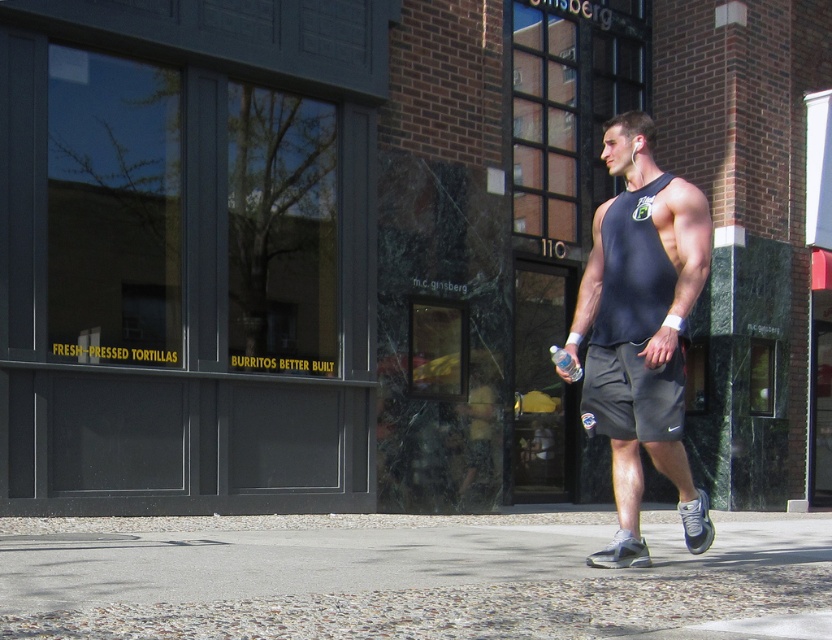
Question: Which of the following is the farthest from the observer?

Choices:
 (A) gray fabric shorts at center
 (B) gray cobblestone pavement at lower center
 (C) matte black tank top at center

Answer: (A)

Question: Which object is closer to the camera taking this photo?

Choices:
 (A) gray cobblestone pavement at lower center
 (B) gray fabric shorts at center
 (C) matte black tank top at center

Answer: (A)

Question: Does gray cobblestone pavement at lower center appear over gray fabric shorts at center?

Choices:
 (A) no
 (B) yes

Answer: (A)

Question: Can you confirm if gray cobblestone pavement at lower center is wider than matte black tank top at center?

Choices:
 (A) yes
 (B) no

Answer: (B)

Question: Is matte black tank top at center closer to the viewer compared to gray fabric shorts at center?

Choices:
 (A) yes
 (B) no

Answer: (A)

Question: Which object is farther from the camera taking this photo?

Choices:
 (A) gray fabric shorts at center
 (B) gray cobblestone pavement at lower center

Answer: (A)